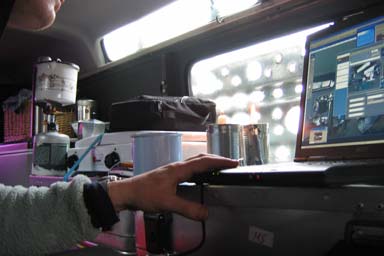
Where is `desk`? desk is located at coordinates (364, 188).